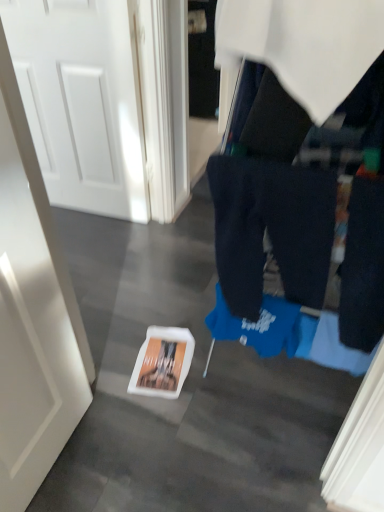
Question: Do you think dark blue cotton trousers at center is within white glossy door at left, the first door when ordered from front to back, or outside of it?

Choices:
 (A) inside
 (B) outside

Answer: (B)

Question: Considering the positions of dark blue cotton trousers at center and white glossy door at left, the first door ordered from the bottom, in the image, is dark blue cotton trousers at center bigger or smaller than white glossy door at left, the first door ordered from the bottom,?

Choices:
 (A) small
 (B) big

Answer: (A)

Question: Considering the real-world distances, which object is closest to the white glossy door at left, marked as the 2th door in a back-to-front arrangement?

Choices:
 (A) dark blue cotton trousers at center
 (B) white glossy door at upper left, arranged as the second door when viewed from the front
 (C) blue fabric at center

Answer: (A)

Question: Which of these objects is positioned farthest from the dark blue cotton trousers at center?

Choices:
 (A) white glossy door at upper left, which is the 1th door in back-to-front order
 (B) blue fabric at center
 (C) white glossy door at left, the first door ordered from the bottom

Answer: (A)